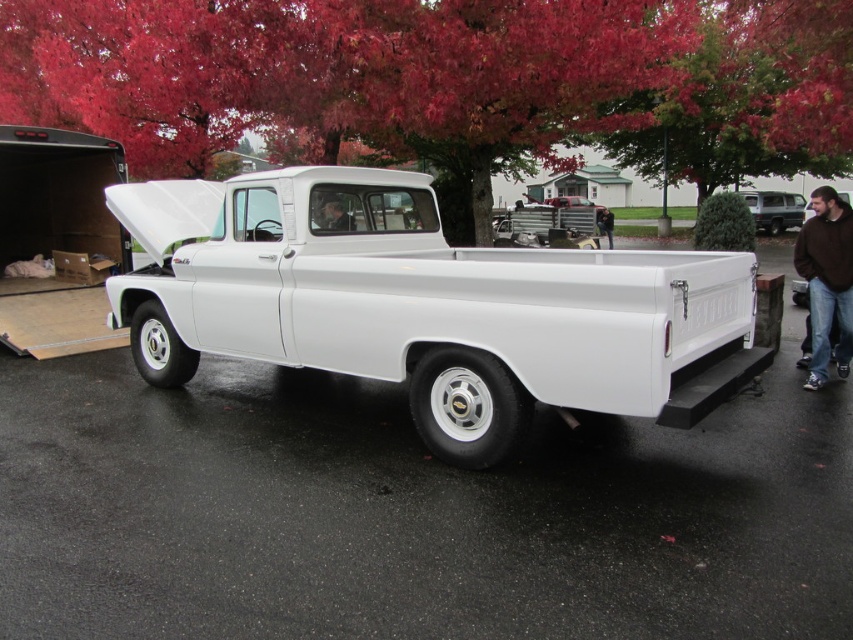
You are a delivery person with a package that needs to be placed on the ground between the white glossy pickup truck at center and the brown fuzzy sweater at right. The package is 3 meters long. Can you fit the package between them without bending it?

The distance between the white glossy pickup truck at center and the brown fuzzy sweater at right is 3.27 meters. Since the package is 3 meters long, it can fit between them without bending.